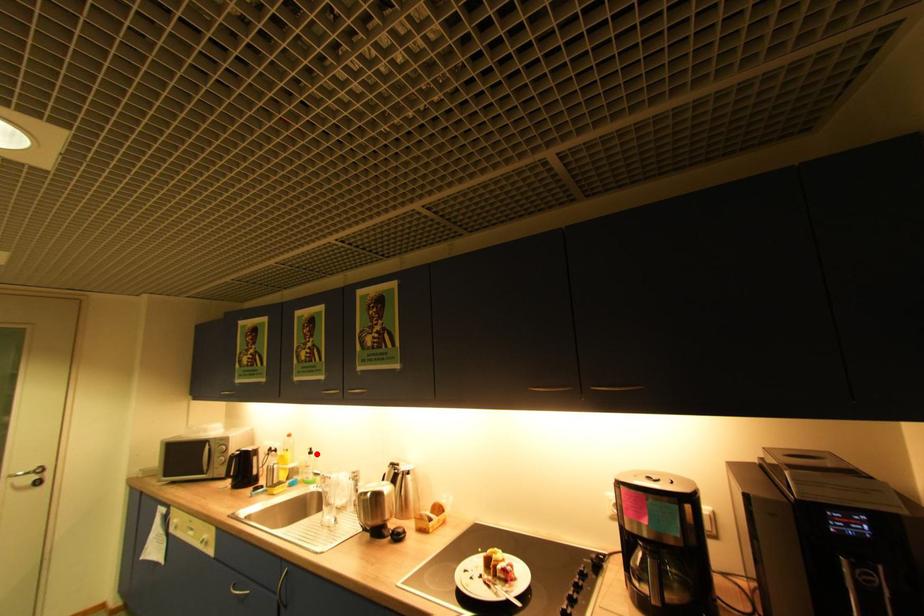
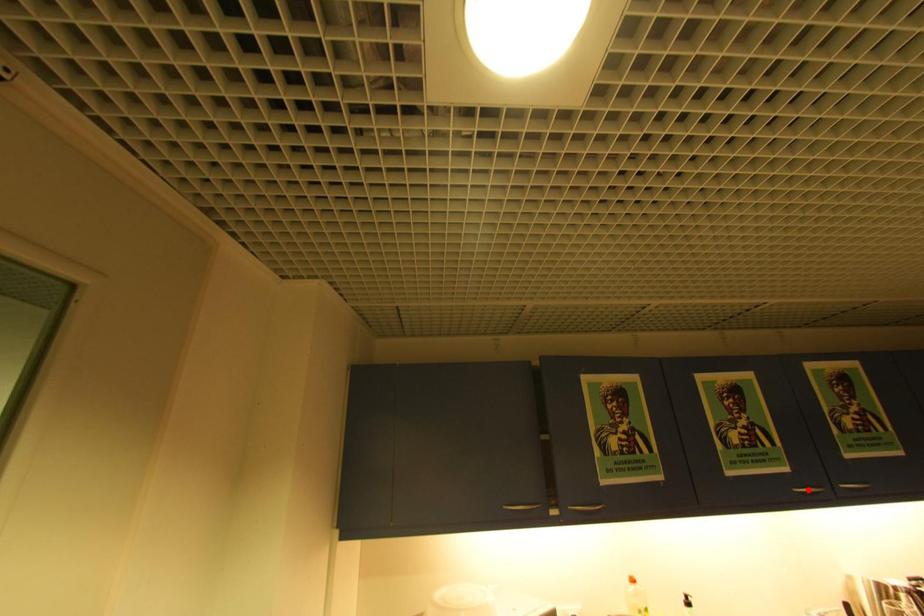
Based on the photo, I am providing you with two images of the same scene from different viewpoints. A red point is marked on the first image and another point is marked on the second image. Are the points marked in image1 and image2 representing the same 3D position?

No